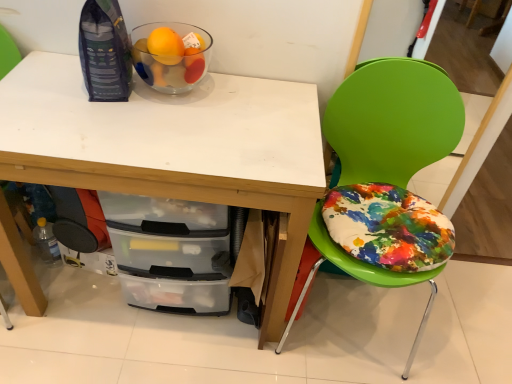
Image resolution: width=512 pixels, height=384 pixels. In order to click on free space in front of clear plastic bottle at lower left in this screenshot , I will do `click(45, 298)`.